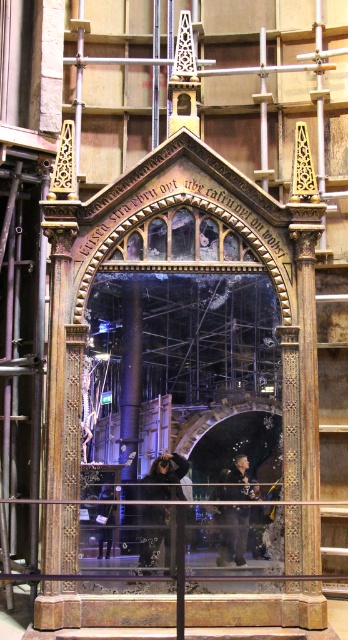
Can you confirm if black fabric construction worker at center is positioned above black leather jacket at lower center?

Yes, black fabric construction worker at center is above black leather jacket at lower center.

The width and height of the screenshot is (348, 640). Describe the element at coordinates (155, 534) in the screenshot. I see `black fabric construction worker at center` at that location.

Where is `black fabric construction worker at center`? The image size is (348, 640). black fabric construction worker at center is located at coordinates (155, 534).

At what (x,y) coordinates should I click in order to perform the action: click on black fabric construction worker at center. Please return your answer as a coordinate pair (x, y). This screenshot has width=348, height=640. Looking at the image, I should click on (155, 534).